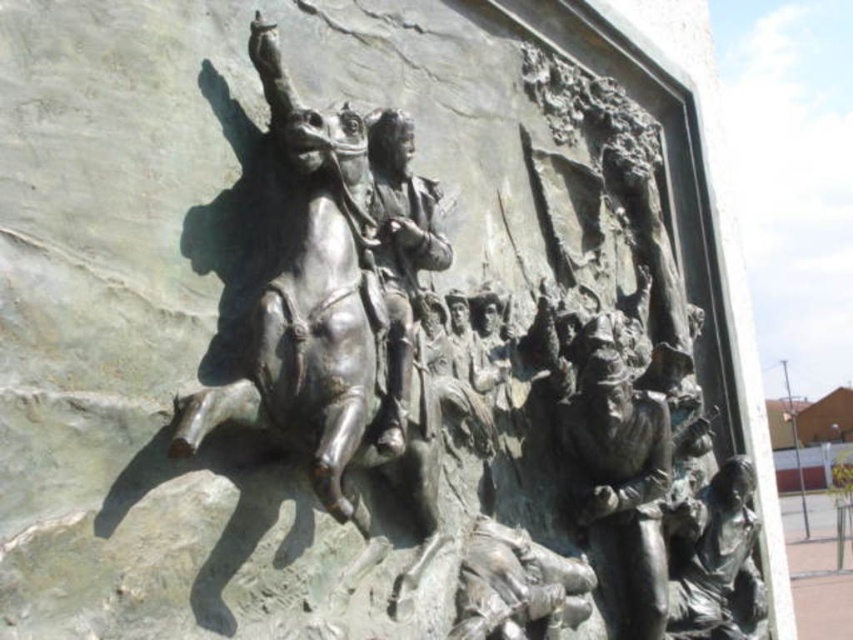
You are standing in front of the bronze relief sculpture. There are two bronze figures at the center. How far apart are the bronze statue figure at center and the bronze figure at center?

The bronze statue figure at center and the bronze figure at center are 36.48 feet apart.

Consider the image. You are an art conservator assessing the bronze relief sculpture. You need to determine if the bronze statue figure at center is the central focus of the bronze sculpture at center. Based on their sizes, can you conclude this?

The bronze sculpture at center is taller than the bronze statue figure at center, so the bronze statue figure at center is not the central focus since it is smaller than the overall sculpture.

You are standing in front of a bronze relief sculpture that has a central figure and a central sculpture. According to the scene, where is the bronze sculpture at center located in relation to the bronze statue figure at center?

The bronze sculpture at center is positioned on the left side of the bronze statue figure at center.